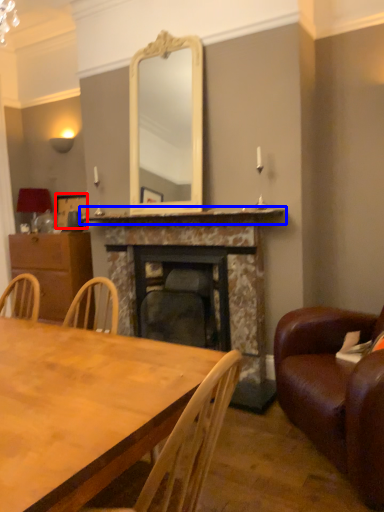
Question: Which object is closer to the camera taking this photo, picture frame (highlighted by a red box) or mantle (highlighted by a blue box)?

Choices:
 (A) picture frame
 (B) mantle

Answer: (B)